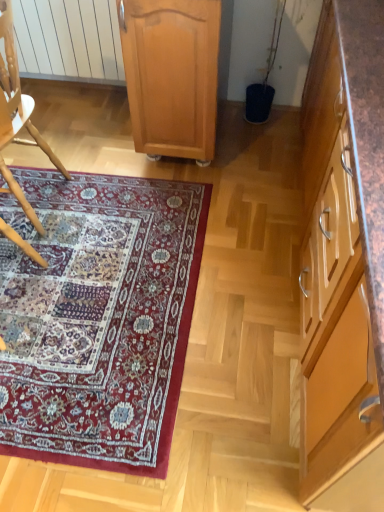
Question: Is wooden chair at left outside brown wood cabinet at right, the 2th cabinetry positioned from the left?

Choices:
 (A) no
 (B) yes

Answer: (B)

Question: Is wooden chair at left shorter than brown wood cabinet at right, the 2th cabinetry positioned from the left?

Choices:
 (A) yes
 (B) no

Answer: (A)

Question: Is wooden chair at left further to the viewer compared to brown wood cabinet at right, arranged as the first cabinetry when viewed from the right?

Choices:
 (A) yes
 (B) no

Answer: (A)

Question: Can you see wooden chair at left touching brown wood cabinet at right, arranged as the first cabinetry when viewed from the right?

Choices:
 (A) yes
 (B) no

Answer: (B)

Question: Is wooden chair at left far away from brown wood cabinet at right, the 2th cabinetry positioned from the left?

Choices:
 (A) no
 (B) yes

Answer: (B)

Question: From a real-world perspective, does wooden chair at left stand above brown wood cabinet at right, arranged as the first cabinetry when viewed from the right?

Choices:
 (A) yes
 (B) no

Answer: (A)

Question: Can you confirm if wooden chair at left is thinner than light brown wood cabinet at center, which is the first cabinetry from left to right?

Choices:
 (A) yes
 (B) no

Answer: (A)

Question: Is light brown wood cabinet at center, which is the first cabinetry from left to right, completely or partially inside wooden chair at left?

Choices:
 (A) no
 (B) yes

Answer: (A)

Question: Does wooden chair at left have a greater height compared to light brown wood cabinet at center, which is the first cabinetry from left to right?

Choices:
 (A) no
 (B) yes

Answer: (B)

Question: Is wooden chair at left next to light brown wood cabinet at center, which is the first cabinetry from left to right?

Choices:
 (A) yes
 (B) no

Answer: (B)

Question: Is wooden chair at left at the left side of light brown wood cabinet at center, arranged as the 2th cabinetry when viewed from the right?

Choices:
 (A) yes
 (B) no

Answer: (A)

Question: Does wooden chair at left have a lesser height compared to light brown wood cabinet at center, which is the first cabinetry from left to right?

Choices:
 (A) no
 (B) yes

Answer: (A)

Question: Is carpet with intricate patterns at lower left far away from wooden chair at left?

Choices:
 (A) yes
 (B) no

Answer: (B)